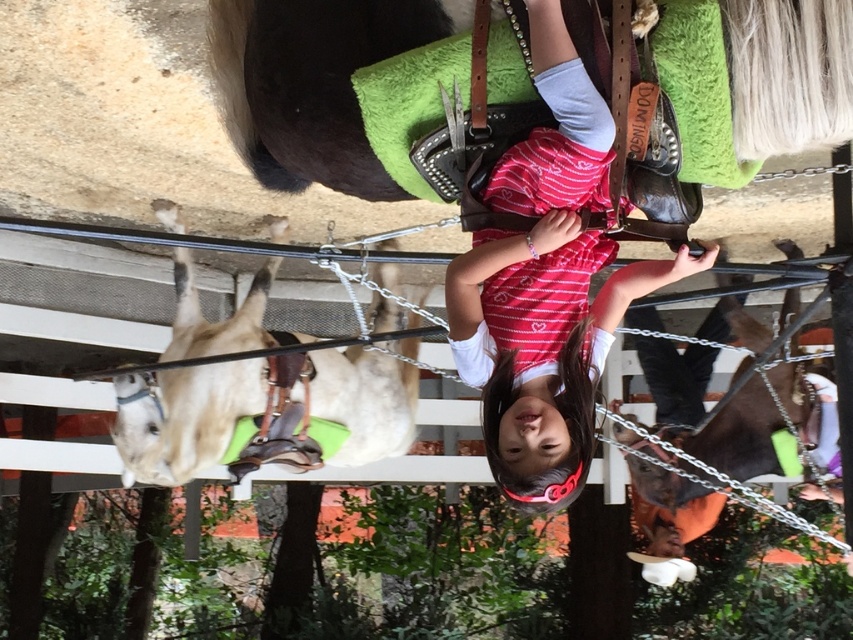
Question: Is matte pink dress at center above light brown leather horse at left?

Choices:
 (A) no
 (B) yes

Answer: (B)

Question: From the image, what is the correct spatial relationship of matte pink dress at center in relation to light brown leather horse at left?

Choices:
 (A) above
 (B) below

Answer: (A)

Question: Among these objects, which one is farthest from the camera?

Choices:
 (A) light brown leather horse at left
 (B) matte pink dress at center

Answer: (A)

Question: Does matte pink dress at center appear on the left side of light brown leather horse at left?

Choices:
 (A) yes
 (B) no

Answer: (B)